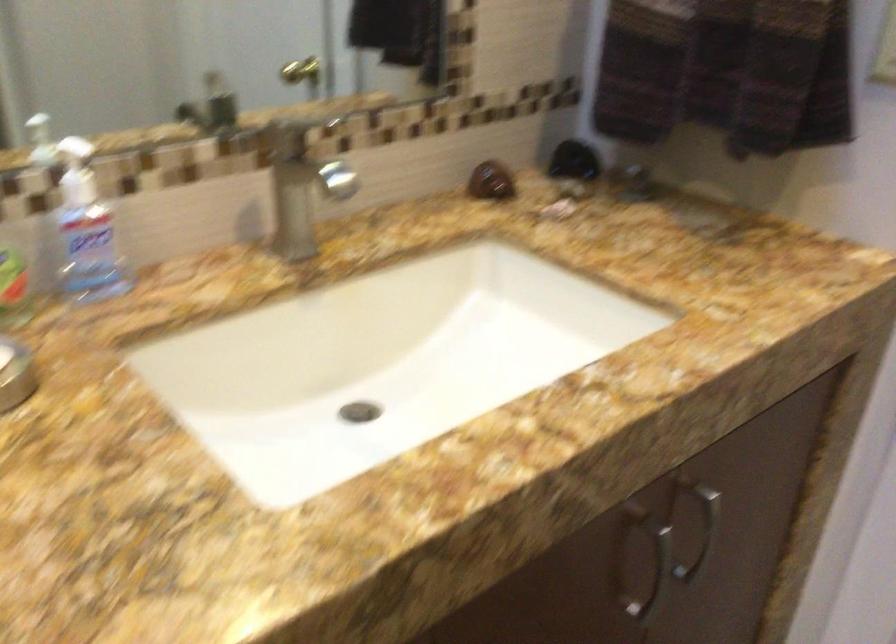
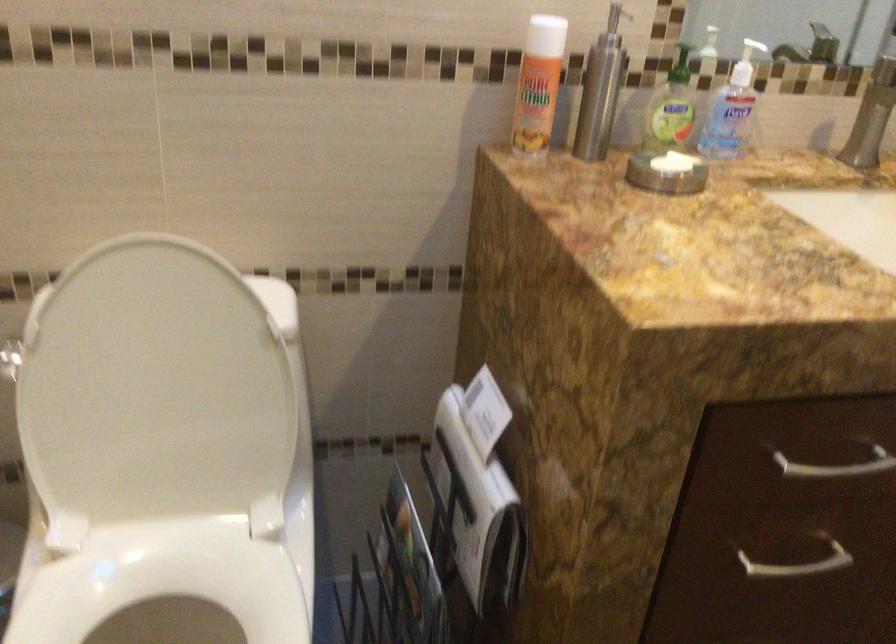
In the second image, find the point that corresponds to [294,196] in the first image.

(872, 116)